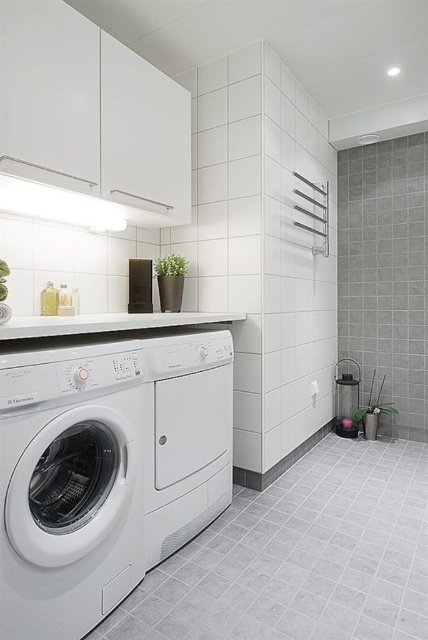
You are a delivery person who needs to place a new washing machine that is 13 inches wide in this laundry room. The existing white matte washing machine at left and white matte washing machine at center are already present. Is there enough space between them to fit the new washing machine?

The distance between the white matte washing machine at left and the white matte washing machine at center is 13.14 inches. Since the new washing machine is 13 inches wide, there is just enough space to fit it between them.

You are moving into this laundry room and need to place a new laundry basket between the white matte washing machine at left and the white matte washing machine at center. Which washing machine should you place the basket closer to if you want it to be near the larger one?

The white matte washing machine at center is larger, so placing the basket closer to it would position it near the larger one.

You are organizing the laundry room and need to place a new shelf above the white matte washing machine at left. However, there is already a white matte washing machine at center above it. Is there enough vertical space between them to install the shelf?

The white matte washing machine at left is below the white matte washing machine at center, meaning there is no vertical space between them. Installing a shelf above the white matte washing machine at left would interfere with the existing white matte washing machine at center.